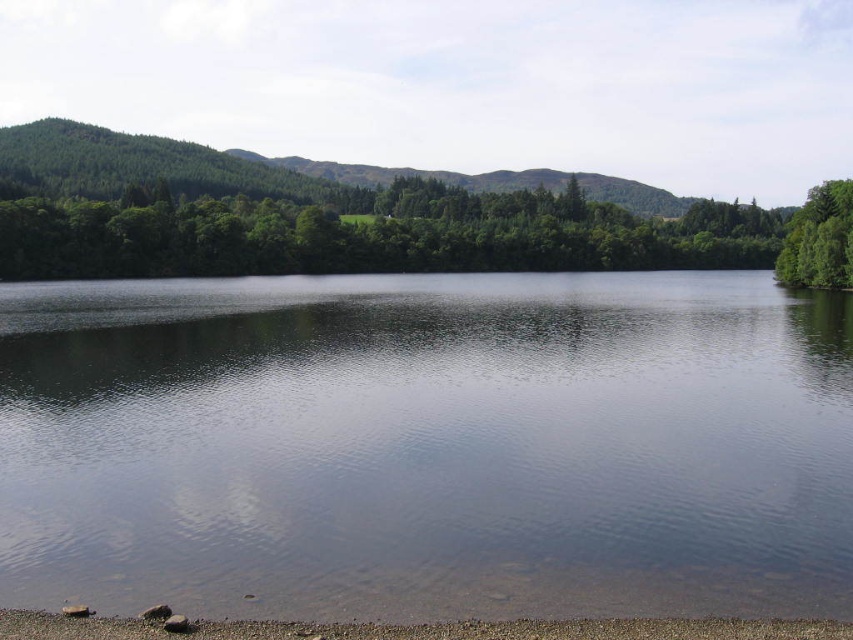
You are standing at the center of the lake and want to reach the green leafy tree at upper center. Which direction should you head towards?

The green leafy tree at upper center is located at point coordinates of 0.342 on the x axis and 0.433 on the y axis. Since you are at the center of the lake, you should move towards the upper direction to reach the green leafy tree at upper center.

You are standing at the shoreline composed of pebbles or small stones. Looking towards the clear water at center, which direction should you face to see it directly?

The clear water at center is located at point 0.697 on the horizontal axis and 0.502 on the vertical axis. Since you are at the shoreline at the bottom of the frame, facing towards the clear water at center would require you to look directly ahead as it is centered in the scene.